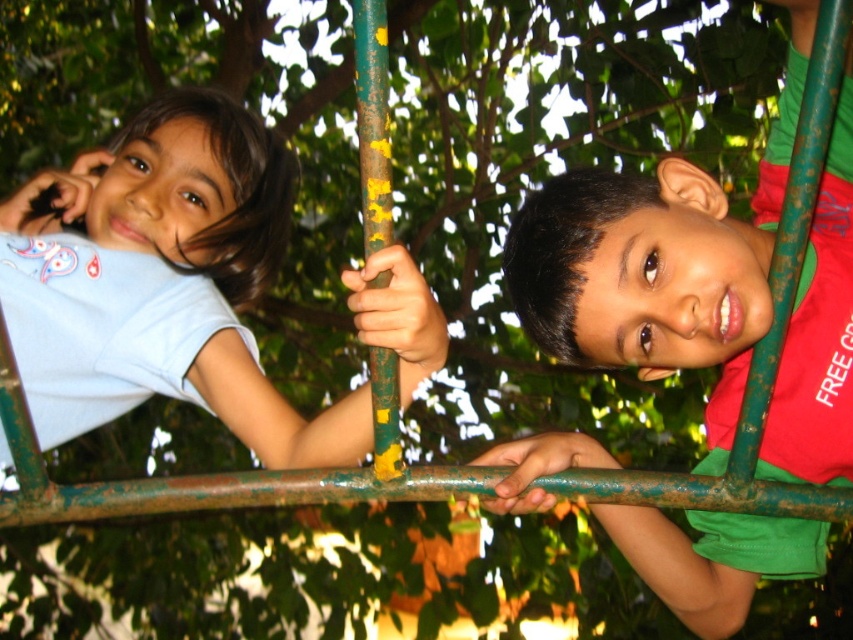
Describe the element at coordinates (163, 284) in the screenshot. I see `matte blue shirt at left` at that location.

Between matte blue shirt at left and green matte shirt at center, which one appears on the right side from the viewer's perspective?

green matte shirt at center

I want to click on matte blue shirt at left, so click(163, 284).

Who is taller, green matte shirt at center or green weathered pole at center?

green matte shirt at center

Is green matte shirt at center to the right of green weathered pole at center from the viewer's perspective?

Indeed, green matte shirt at center is positioned on the right side of green weathered pole at center.

Does point (730, 330) come farther from viewer compared to point (383, 433)?

Yes, point (730, 330) is farther from viewer.

Where is `green matte shirt at center`? The height and width of the screenshot is (640, 853). green matte shirt at center is located at coordinates (646, 275).

Which of these two, matte blue shirt at left or green weathered pole at center, stands shorter?

With less height is green weathered pole at center.

Is matte blue shirt at left bigger than green weathered pole at center?

Correct, matte blue shirt at left is larger in size than green weathered pole at center.

Is point (32, 294) in front of point (386, 108)?

No, (32, 294) is behind (386, 108).

Locate an element on the screen. The image size is (853, 640). matte blue shirt at left is located at coordinates (163, 284).